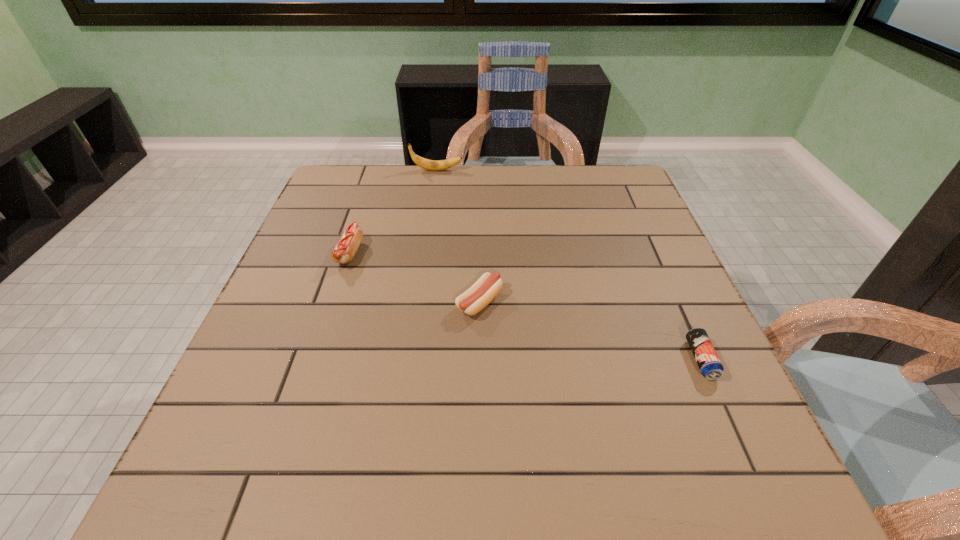
In order to click on vacant space in between the banana and the beer can in this screenshot , I will do `click(568, 265)`.

Locate which object ranks second in proximity to the beer can. Please provide its 2D coordinates. Your answer should be formatted as a tuple, i.e. [(x, y)], where the tuple contains the x and y coordinates of a point satisfying the conditions above.

[(344, 251)]

Select which object appears as the second closest to the shorter sausage. Please provide its 2D coordinates. Your answer should be formatted as a tuple, i.e. [(x, y)], where the tuple contains the x and y coordinates of a point satisfying the conditions above.

[(704, 353)]

Identify the location of free space that satisfies the following two spatial constraints: 1. on the peel of the beer can from the top; 2. on the left side of the second object from left to right. (410, 360).

I want to click on blank area in the image that satisfies the following two spatial constraints: 1. on the front side of the taller sausage; 2. on the left side of the shorter sausage, so click(x=333, y=302).

This screenshot has height=540, width=960. In order to click on free space that satisfies the following two spatial constraints: 1. on the back side of the shorter sausage; 2. on the peel of the farthest object from the top in this screenshot , I will do (480, 170).

Locate an element on the screen. The image size is (960, 540). vacant space that satisfies the following two spatial constraints: 1. on the back side of the rightmost object; 2. on the peel of the farthest object from the top is located at coordinates (616, 170).

Find the location of a particular element. free spot that satisfies the following two spatial constraints: 1. on the peel of the third object from left to right from the top; 2. on the left side of the second object from left to right is located at coordinates point(418,302).